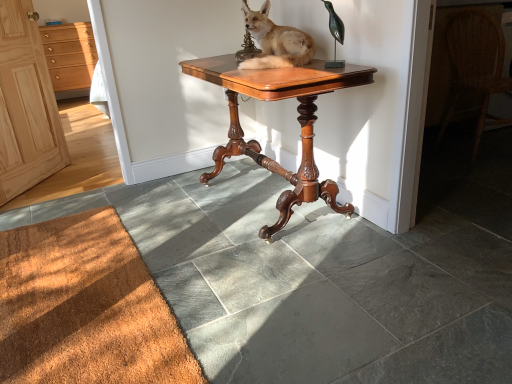
Find the location of a particular element. This screenshot has height=384, width=512. free space in front of mahogany wood table at center is located at coordinates (315, 289).